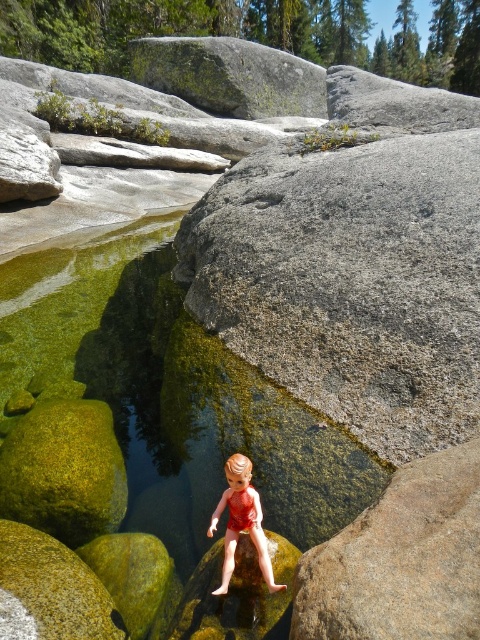
Does gray granite boulder at center have a smaller size compared to green mossy rock at center?

Actually, gray granite boulder at center might be larger than green mossy rock at center.

Locate an element on the screen. Image resolution: width=480 pixels, height=640 pixels. gray granite boulder at center is located at coordinates (400, 560).

This screenshot has width=480, height=640. In order to click on gray granite boulder at center in this screenshot , I will do `click(400, 560)`.

Based on the photo, measure the distance between gray granite boulder at center and camera.

The distance of gray granite boulder at center from camera is 1.27 meters.

Which is below, gray granite boulder at center or matte orange swimsuit at center?

matte orange swimsuit at center is below.

Is point (434, 538) positioned before point (261, 534)?

Yes.

Find the location of a particular element. Image resolution: width=480 pixels, height=640 pixels. gray granite boulder at center is located at coordinates (400, 560).

Is point (159, 420) positioned in front of point (405, 602)?

No, (159, 420) is behind (405, 602).

Does green mossy water at center lie behind gray granite boulder at center?

Yes, it is.

In the scene shown: Who is more forward, (195, 360) or (408, 602)?

Positioned in front is point (408, 602).

Where is `green mossy water at center`? green mossy water at center is located at coordinates (169, 392).